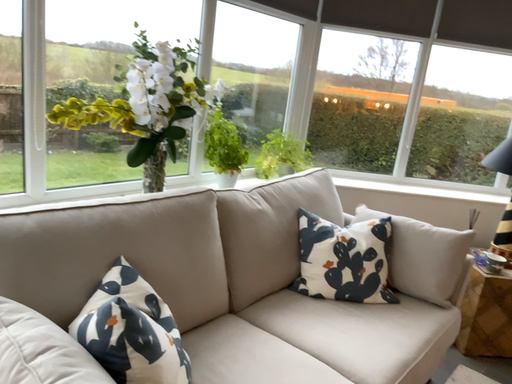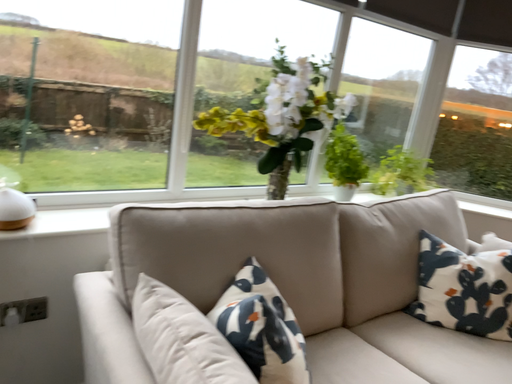
Question: How did the camera likely rotate when shooting the video?

Choices:
 (A) rotated left
 (B) rotated right

Answer: (A)